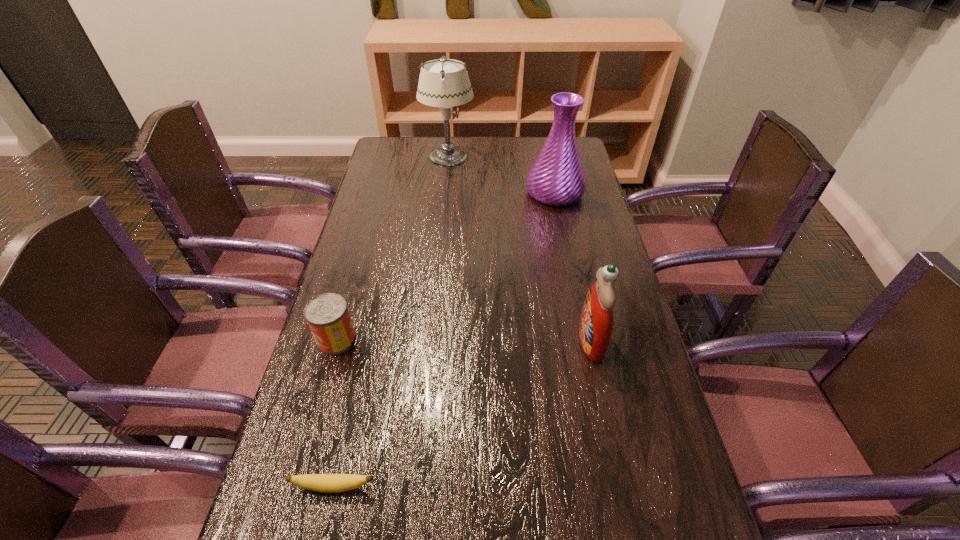
The height and width of the screenshot is (540, 960). In order to click on lampshade in this screenshot , I will do tap(444, 83).

The width and height of the screenshot is (960, 540). I want to click on vase, so click(557, 178).

This screenshot has width=960, height=540. I want to click on detergent, so click(x=596, y=321).

Where is `the third shortest object`? the third shortest object is located at coordinates (327, 314).

What are the coordinates of `the fifth tallest object` in the screenshot? It's located at (330, 483).

The width and height of the screenshot is (960, 540). Find the location of `banana`. banana is located at coordinates (330, 483).

This screenshot has width=960, height=540. Find the location of `free space located on the lampshade of the farthest object`. free space located on the lampshade of the farthest object is located at coordinates click(x=490, y=157).

Where is `free location located on the front of the vase`? The image size is (960, 540). free location located on the front of the vase is located at coordinates (571, 272).

Where is `free space located on the front surface of the fourth shortest object`? The height and width of the screenshot is (540, 960). free space located on the front surface of the fourth shortest object is located at coordinates (420, 340).

The width and height of the screenshot is (960, 540). What are the coordinates of `vacant space situated on the front surface of the fourth shortest object` in the screenshot? It's located at (559, 340).